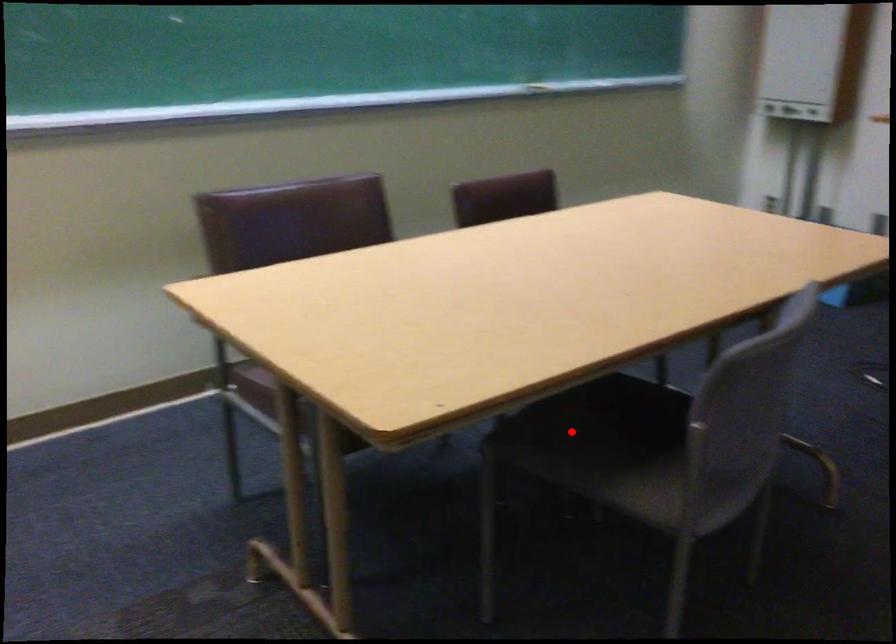
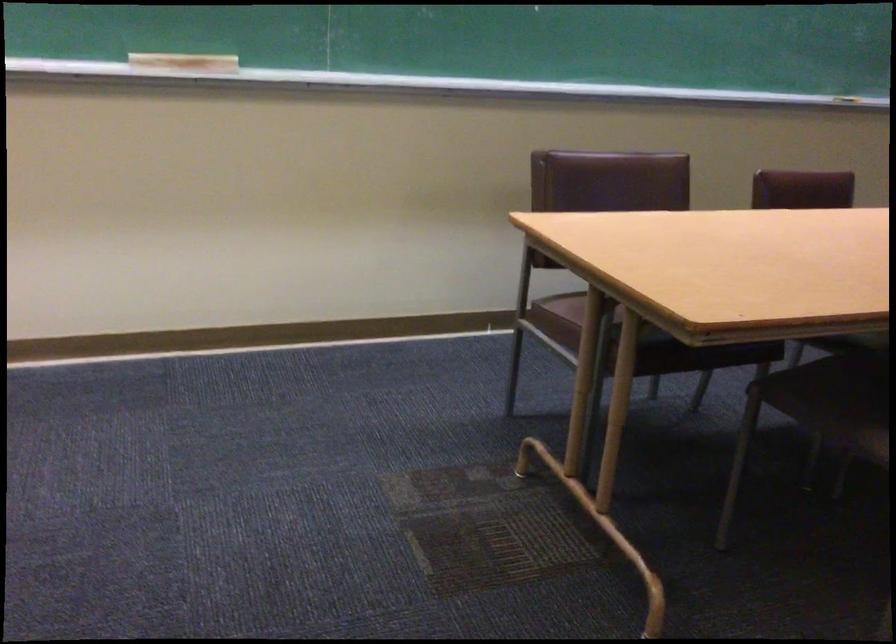
Where in the second image is the point corresponding to the highlighted location from the first image?

(833, 391)